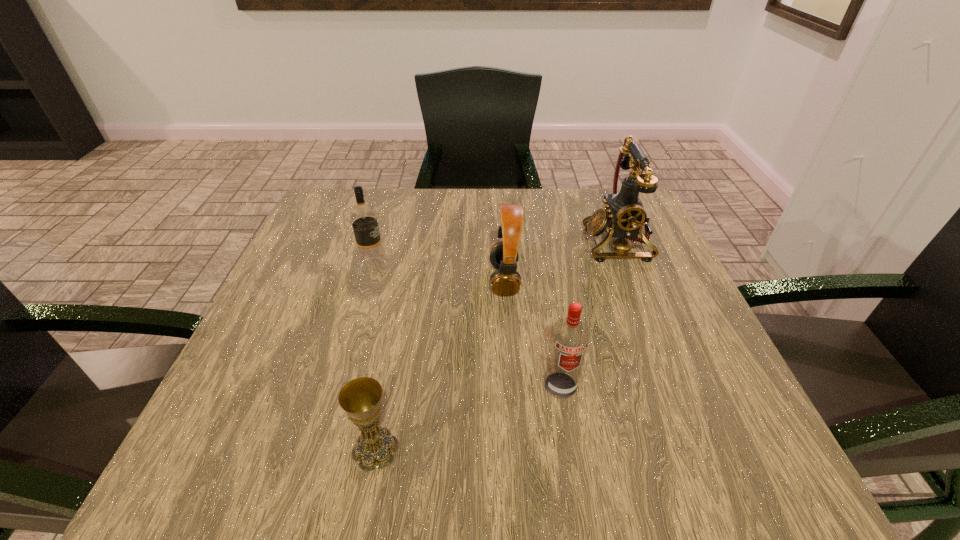
At what (x,y) coordinates should I click in order to perform the action: click on vacant space located on the front of the telephone, featuring the rotary dial. Please return your answer as a coordinate pair (x, y). Looking at the image, I should click on point(537,242).

Locate an element on the screen. vacant space located on the front of the telephone, featuring the rotary dial is located at coordinates (471, 242).

The width and height of the screenshot is (960, 540). I want to click on vacant position located on the label of the leftmost object, so click(498, 266).

The height and width of the screenshot is (540, 960). I want to click on vacant space located on the front label of the fourth object from left to right, so click(569, 442).

Identify the location of blank space located on the ear cups of the headset. The width and height of the screenshot is (960, 540). (466, 279).

You are a GUI agent. You are given a task and a screenshot of the screen. Output one action in this format:
    pyautogui.click(x=<x>, y=<y>)
    Task: Click on the free region located 0.370m on the ear cups of the headset
    The image size is (960, 540).
    Given the screenshot: What is the action you would take?
    pyautogui.click(x=311, y=279)

You are a GUI agent. You are given a task and a screenshot of the screen. Output one action in this format:
    pyautogui.click(x=<x>, y=<y>)
    Task: Click on the blank area located on the ear cups of the headset
    
    Given the screenshot: What is the action you would take?
    pyautogui.click(x=370, y=279)

Image resolution: width=960 pixels, height=540 pixels. Identify the location of vacant position located on the back of the nearest object. (406, 288).

At what (x,y) coordinates should I click in order to perform the action: click on object positioned at the far edge. Please return your answer as a coordinate pair (x, y). Looking at the image, I should click on (624, 216).

At what (x,y) coordinates should I click in order to perform the action: click on object situated at the near edge. Please return your answer as a coordinate pair (x, y). Image resolution: width=960 pixels, height=540 pixels. Looking at the image, I should click on 360,398.